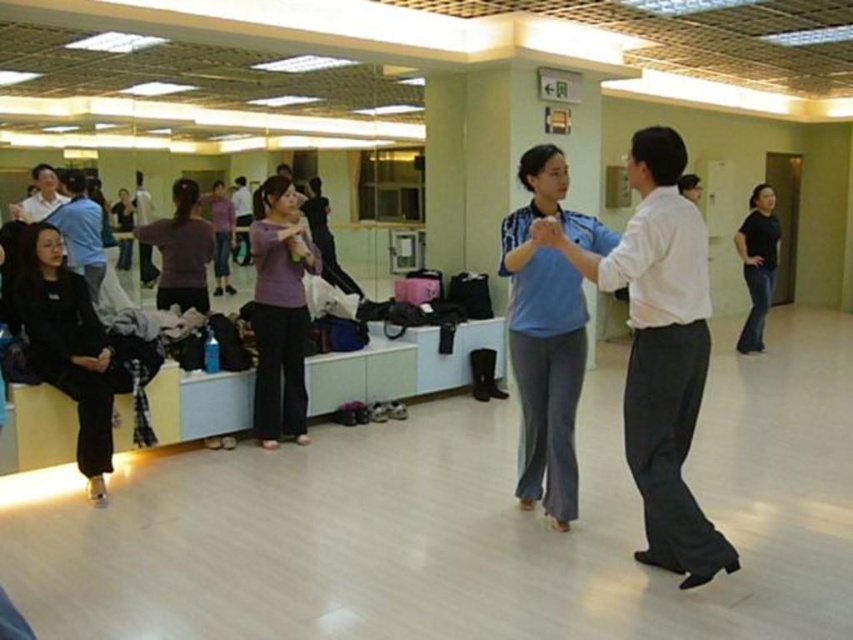
You are standing in the dance studio and want to move from the point at coordinate point (544,211) to the point at coordinate point (33,289). Can you walk directly between them without any obstruction?

Point (544,211) is in front of point (33,289), so there is an obstruction between them. You cannot walk directly between them without any obstruction.

You are a photographer standing at the back of the dance studio. You want to take a photo that includes both point (676,336) and point (109,435). Which point should you focus on to ensure both are in sharp focus?

You should focus on point (676,336) because it is closer to the camera than point (109,435), ensuring both points are within the depth of field.

You are standing at the entrance of the dance studio and see the white smooth shirt at center. Where would you look to find it?

The white smooth shirt at center is located at the coordinates point (x=660, y=349).